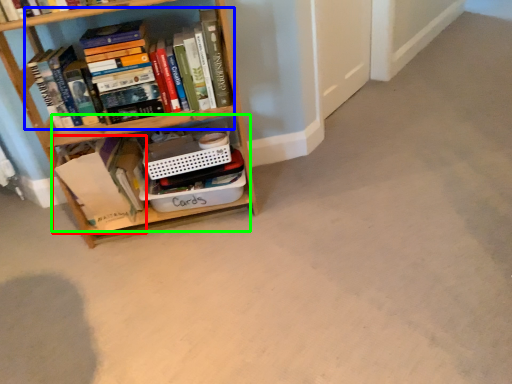
Question: Which object is the closest to the book (highlighted by a red box)? Choose among these: book (highlighted by a blue box) or cabinet (highlighted by a green box).

Choices:
 (A) book
 (B) cabinet

Answer: (B)